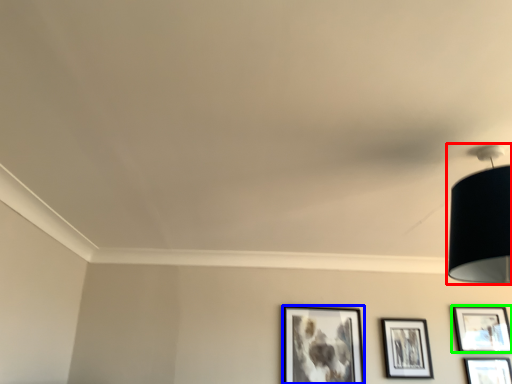
Question: Which is farther away from lamp (highlighted by a red box)? picture frame (highlighted by a blue box) or picture frame (highlighted by a green box)?

Choices:
 (A) picture frame
 (B) picture frame

Answer: (B)